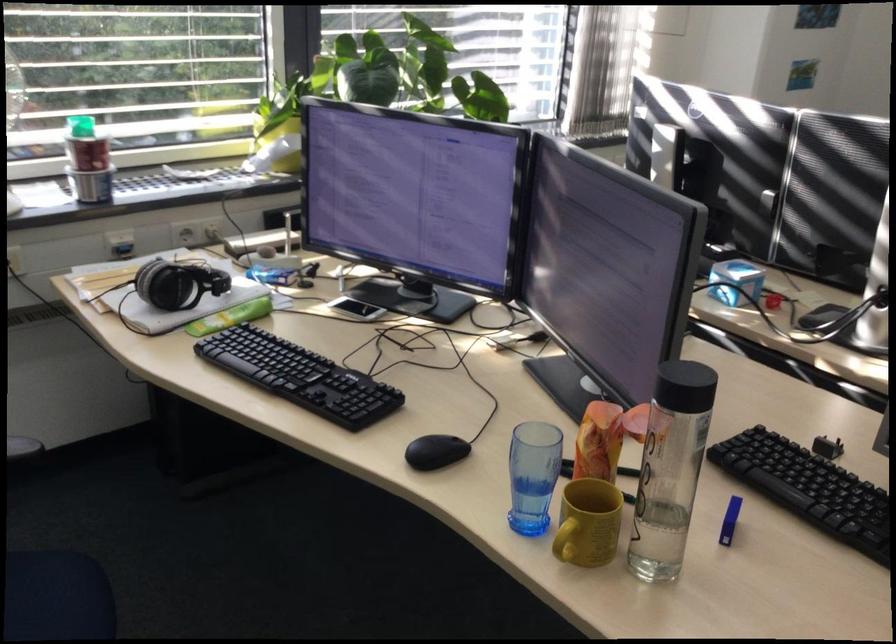
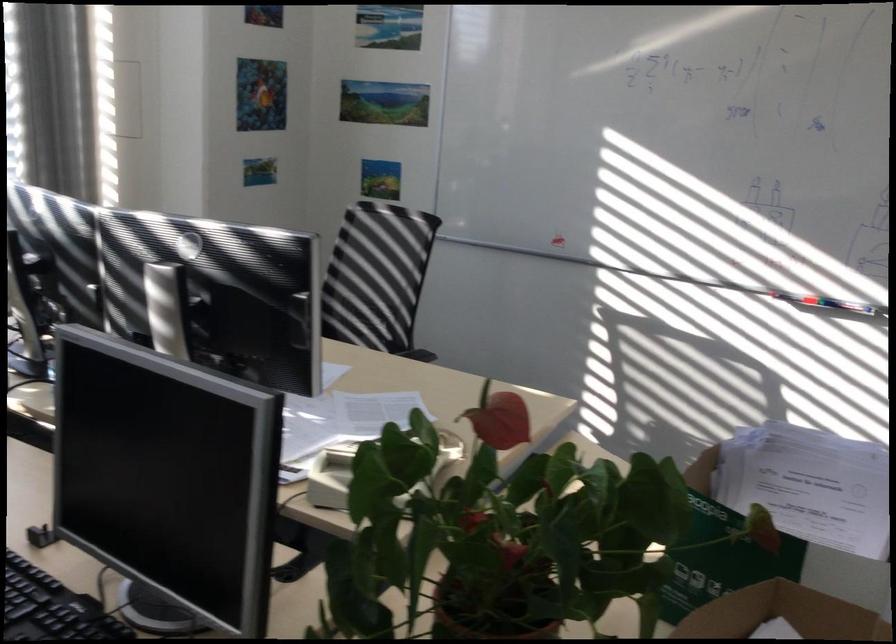
Question: The images are taken continuously from a first-person perspective. In which direction are you moving?

Choices:
 (A) Left
 (B) Right
 (C) Forward
 (D) Backward

Answer: (B)